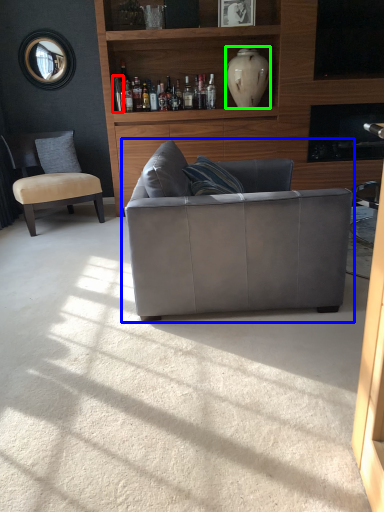
Question: Considering the real-world distances, which object is closest to bottle (highlighted by a red box)? studio couch (highlighted by a blue box) or vase (highlighted by a green box).

Choices:
 (A) studio couch
 (B) vase

Answer: (B)